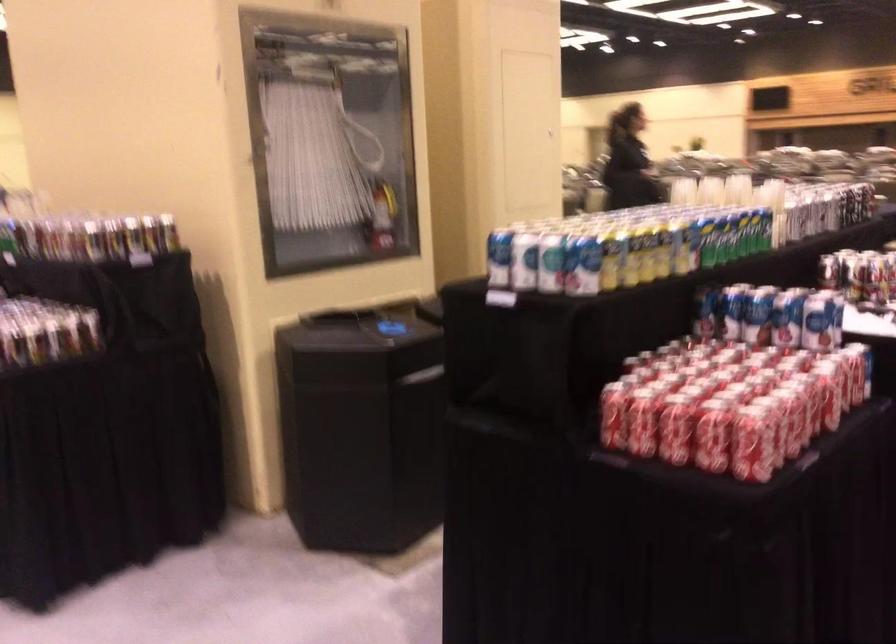
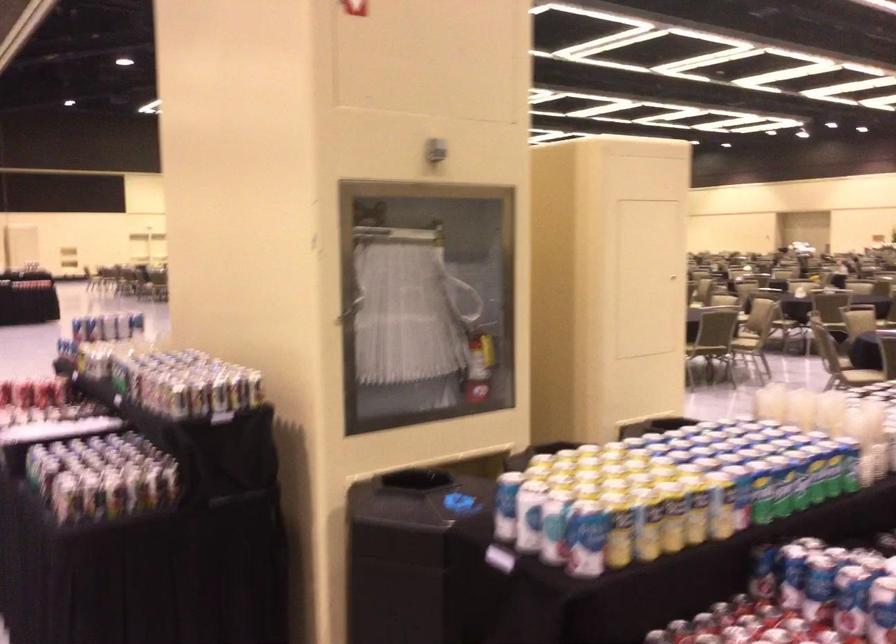
Locate, in the second image, the point that corresponds to pixel 721 231 in the first image.

(780, 486)